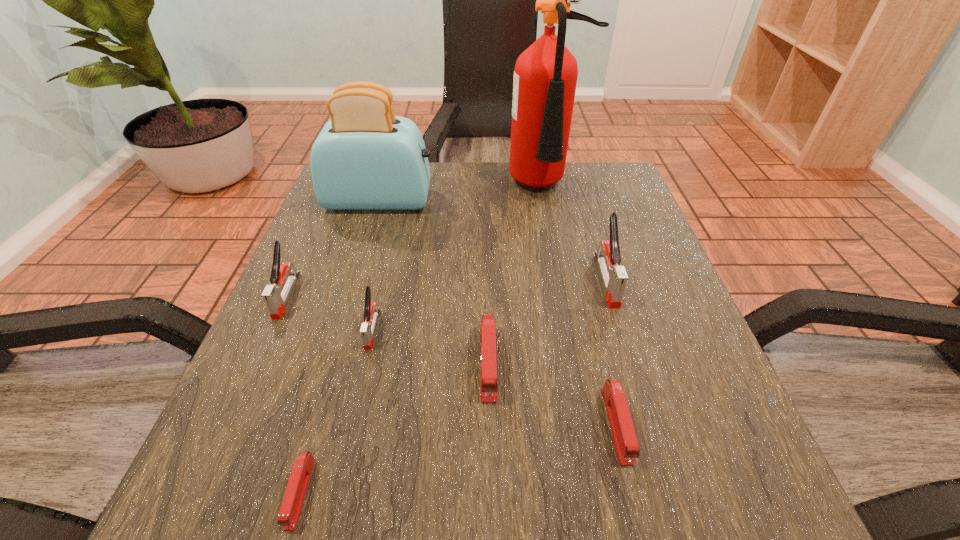
Image resolution: width=960 pixels, height=540 pixels. What are the coordinates of `the fifth object from left to right` in the screenshot? It's located at (489, 384).

You are a GUI agent. You are given a task and a screenshot of the screen. Output one action in this format:
    pyautogui.click(x=<x>, y=<y>)
    Task: Click on the biggest red stapler
    The image size is (960, 540).
    Given the screenshot: What is the action you would take?
    pyautogui.click(x=489, y=384)

The image size is (960, 540). Find the location of `the fifth tallest stapler`. the fifth tallest stapler is located at coordinates (623, 432).

You are a GUI agent. You are given a task and a screenshot of the screen. Output one action in this format:
    pyautogui.click(x=<x>, y=<y>)
    Task: Click on the second smallest red stapler
    This screenshot has height=540, width=960.
    Given the screenshot: What is the action you would take?
    pyautogui.click(x=623, y=432)

Identify the location of the shortest object. This screenshot has height=540, width=960. (291, 506).

At what (x,y) coordinates should I click in order to perform the action: click on the leftmost red stapler. Please return your answer as a coordinate pair (x, y). Looking at the image, I should click on (291, 506).

You are a GUI agent. You are given a task and a screenshot of the screen. Output one action in this format:
    pyautogui.click(x=<x>, y=<y>)
    Task: Click on the vacant space located at the nozzle of the red fire extinguisher
    
    Given the screenshot: What is the action you would take?
    pyautogui.click(x=577, y=332)

Where is `vacant space located 0.150m on the side of the toaster with the lever`? This screenshot has height=540, width=960. vacant space located 0.150m on the side of the toaster with the lever is located at coordinates (496, 200).

Identify the location of blank space located 0.300m on the handle side of the rightmost gray stapler. (665, 475).

Where is `vacant region located on the handle side of the leftmost stapler`? The image size is (960, 540). vacant region located on the handle side of the leftmost stapler is located at coordinates (197, 496).